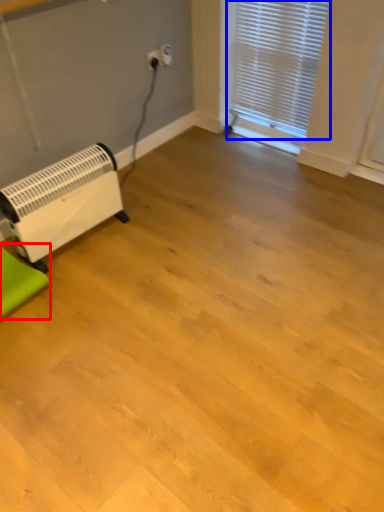
Question: Which object is further to the camera taking this photo, furniture (highlighted by a red box) or window blind (highlighted by a blue box)?

Choices:
 (A) furniture
 (B) window blind

Answer: (B)